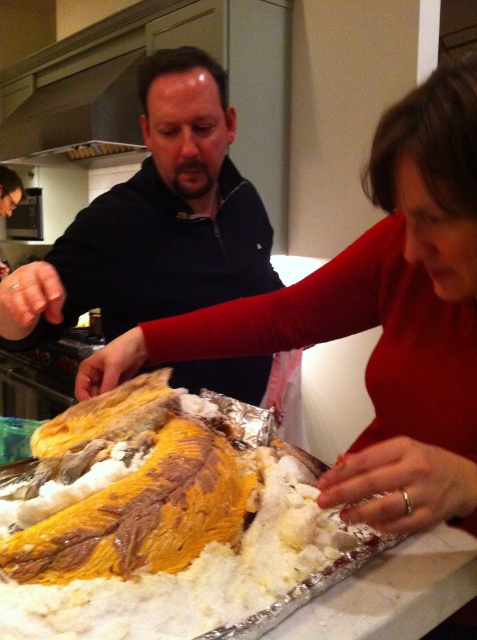
Question: Is golden-brown crispy fish at center smaller than dark blue sweater at center?

Choices:
 (A) yes
 (B) no

Answer: (A)

Question: Among these objects, which one is nearest to the camera?

Choices:
 (A) golden-brown crispy fish at center
 (B) dark blue sweater at center

Answer: (A)

Question: In this image, where is golden-brown crispy fish at center located relative to dark blue sweater at center?

Choices:
 (A) above
 (B) below

Answer: (B)

Question: Which point appears closest to the camera in this image?

Choices:
 (A) (79, 268)
 (B) (313, 509)

Answer: (B)

Question: Does golden-brown crispy fish at center appear on the right side of dark blue sweater at center?

Choices:
 (A) no
 (B) yes

Answer: (B)